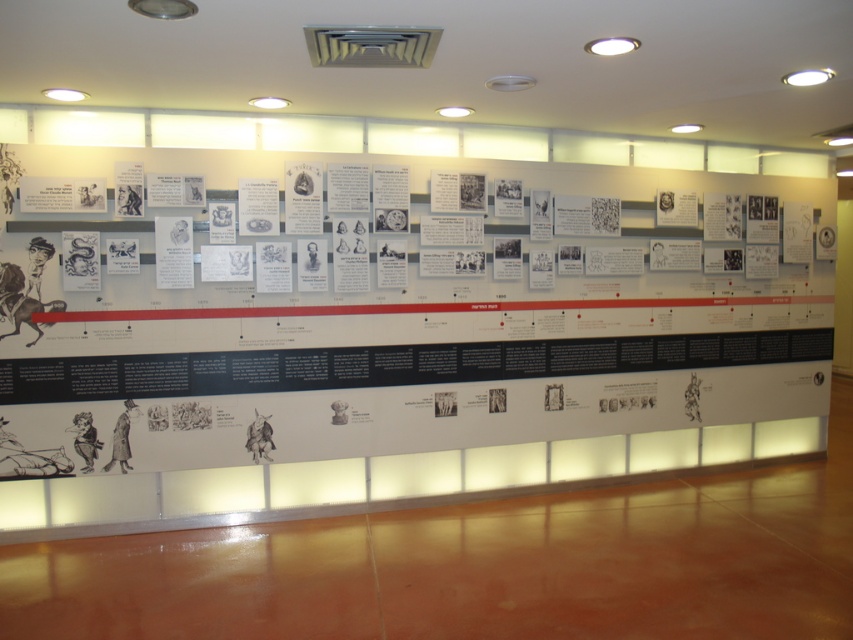
You are a visitor at the museum and want to read the information on both the white paper poster at center and the white paper poster at left. However, you notice that one of them is partially hidden by another object. Which poster is more visible to you?

The white paper poster at left is more visible because the white paper poster at center is positioned under it, meaning it is partially obscured by the poster at left.

You are a visitor at the museum and want to read both the white paper poster at center and the white paper poster at left. Which poster do you think you can see the top part of more easily without needing to move closer?

The white paper poster at center has a greater height compared to the white paper poster at left, so its top part is more easily visible without moving closer.

You are a visitor at the museum and want to read the white paper poster at center and the white paper poster at left. Since you can only read one at a time, which one should you stand closer to the right side of the display to read?

The white paper poster at center is to the right of the white paper poster at left, so to read it, you should stand closer to the right side of the display.